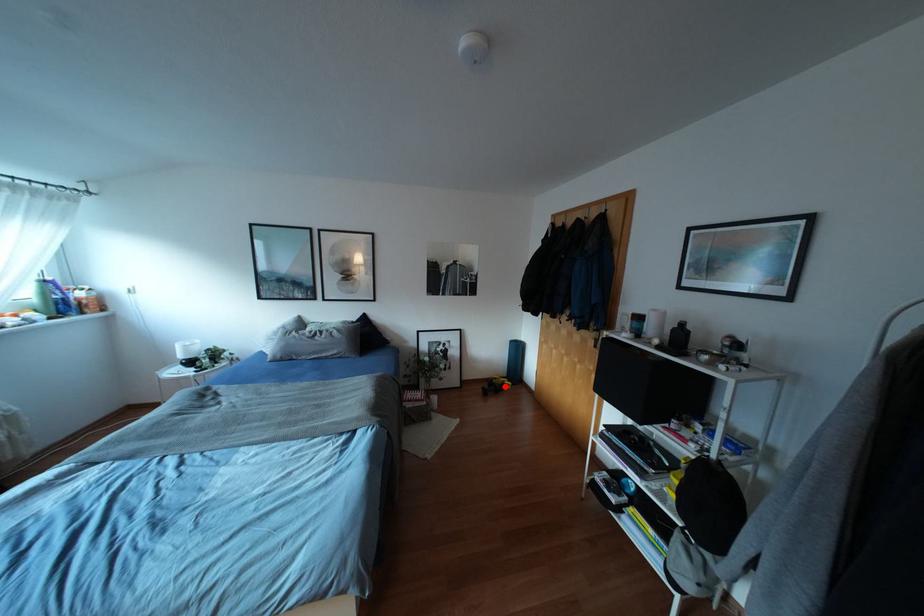
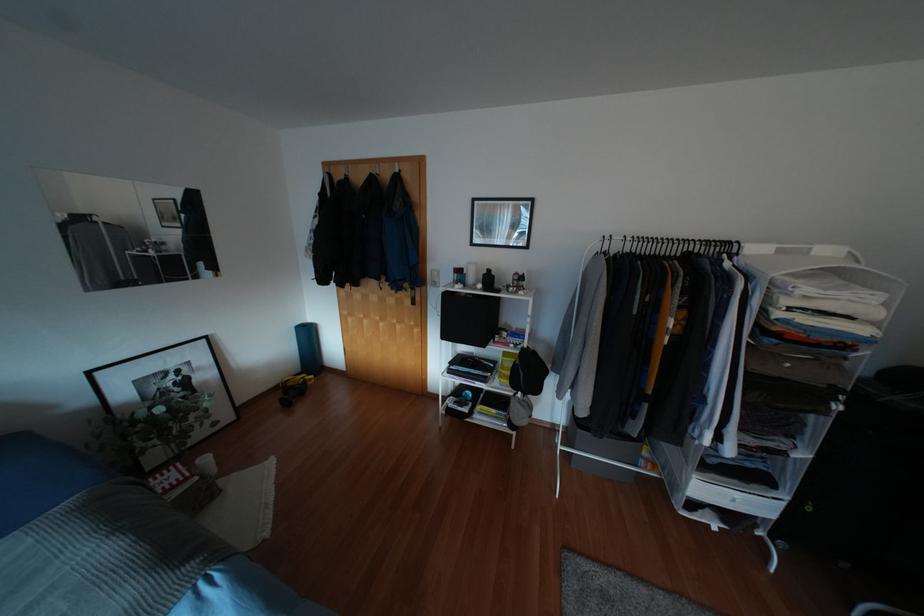
Find the pixel in the second image that matches the highlighted location in the first image.

(309, 383)